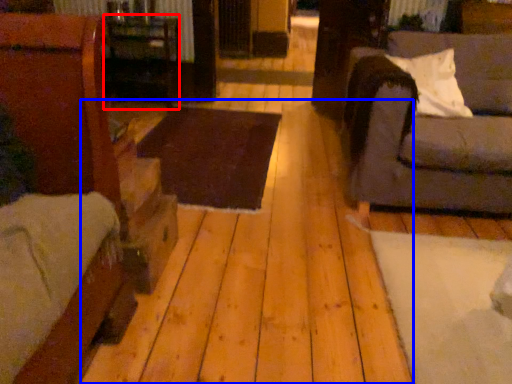
Question: Which of the following is the closest to the observer, table (highlighted by a red box) or plywood (highlighted by a blue box)?

Choices:
 (A) table
 (B) plywood

Answer: (B)